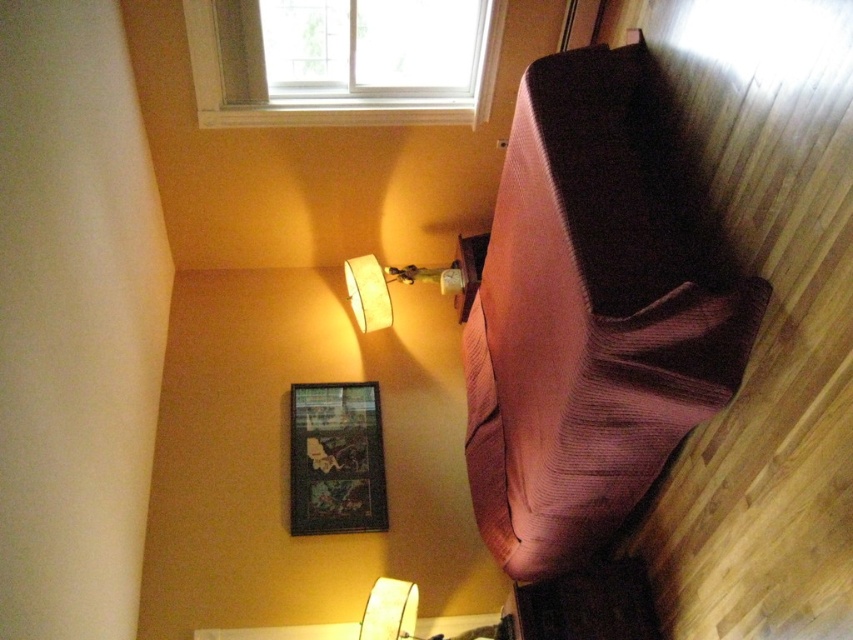
Does pink corduroy sleeping bag at right lie in front of white fabric lampshade at upper center?

Yes, it is.

Who is shorter, pink corduroy sleeping bag at right or white fabric lampshade at upper center?

white fabric lampshade at upper center is shorter.

Is point (485, 474) positioned behind point (387, 276)?

That is False.

Where is `pink corduroy sleeping bag at right`? The image size is (853, 640). pink corduroy sleeping bag at right is located at coordinates (590, 314).

From the picture: Between pink corduroy sleeping bag at right and white plastic window at upper center, which one appears on the right side from the viewer's perspective?

pink corduroy sleeping bag at right is more to the right.

Who is lower down, pink corduroy sleeping bag at right or white plastic window at upper center?

pink corduroy sleeping bag at right is below.

Does point (585, 112) come farther from viewer compared to point (206, 19)?

No, it is in front of (206, 19).

What are the coordinates of `pink corduroy sleeping bag at right` in the screenshot? It's located at (590, 314).

In order to click on white plastic window at upper center in this screenshot , I will do `click(341, 60)`.

Can you confirm if white plastic window at upper center is taller than white fabric lampshade at upper center?

Indeed, white plastic window at upper center has a greater height compared to white fabric lampshade at upper center.

The width and height of the screenshot is (853, 640). What are the coordinates of `white plastic window at upper center` in the screenshot? It's located at (341, 60).